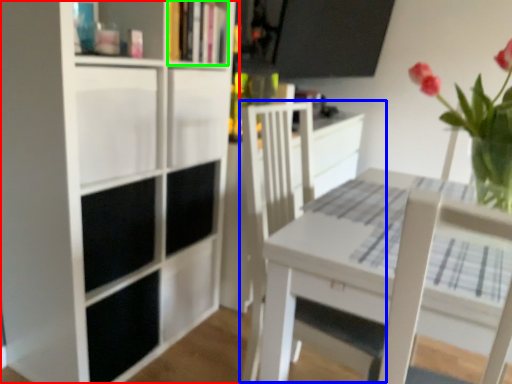
Question: Which is nearer to the bookcase (highlighted by a red box)? swivel chair (highlighted by a blue box) or book (highlighted by a green box).

Choices:
 (A) swivel chair
 (B) book

Answer: (B)